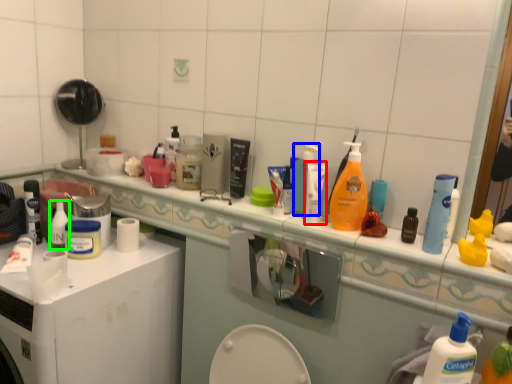
Question: Which is farther away from toiletry (highlighted by a red box)? cleaning product (highlighted by a blue box) or toiletry (highlighted by a green box)?

Choices:
 (A) cleaning product
 (B) toiletry

Answer: (B)